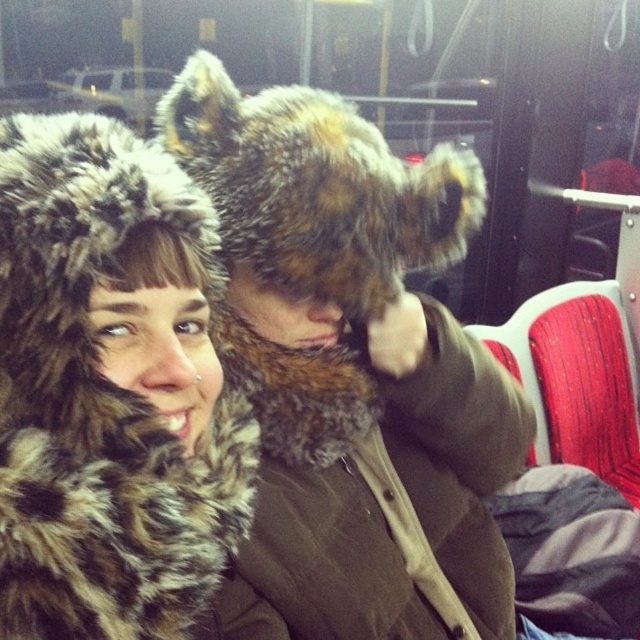
Question: Is fuzzy brown fur hat at center positioned in front of fuzzy fur hat at upper left?

Choices:
 (A) no
 (B) yes

Answer: (A)

Question: Which object is farther from the camera taking this photo?

Choices:
 (A) fuzzy brown fur hat at center
 (B) fuzzy fur hat at upper left

Answer: (A)

Question: Which point is farther to the camera?

Choices:
 (A) (124, 419)
 (B) (406, 237)

Answer: (B)

Question: Can you confirm if fuzzy brown fur hat at center is wider than fuzzy fur hat at upper left?

Choices:
 (A) yes
 (B) no

Answer: (A)

Question: Is fuzzy brown fur hat at center smaller than fuzzy fur hat at upper left?

Choices:
 (A) yes
 (B) no

Answer: (B)

Question: Among these points, which one is nearest to the camera?

Choices:
 (A) (76, 624)
 (B) (381, 349)

Answer: (A)